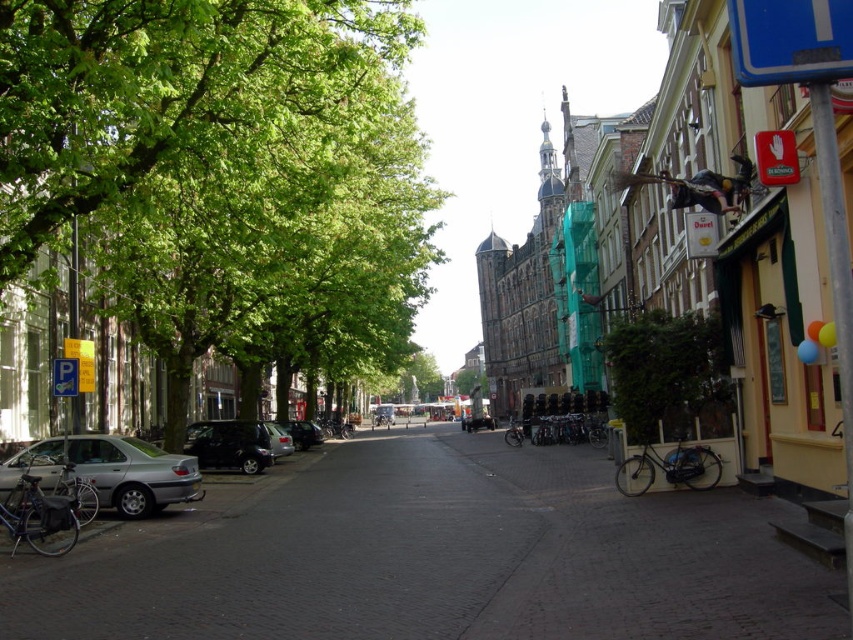
You are standing at the point with coordinates point (42, 529) and want to walk to the point with coordinates point (96, 464). Is the point you want to reach in front of or behind you?

The point (96, 464) is behind point (42, 529), so the destination is behind you.